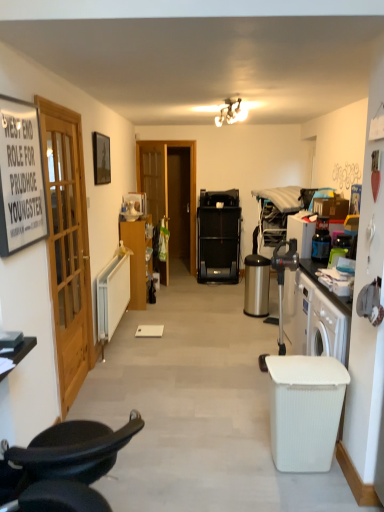
Question: Would you say black paper sign at left, arranged as the 1th picture frame when viewed from the front, is to the left or to the right of matte wood cabinet at left in the picture?

Choices:
 (A) left
 (B) right

Answer: (A)

Question: Relative to matte wood cabinet at left, is black paper sign at left, the second picture frame in the back-to-front sequence, in front or behind?

Choices:
 (A) front
 (B) behind

Answer: (A)

Question: Based on their relative distances, which object is farther from the matte white light fixture at upper center?

Choices:
 (A) black leather chair at lower left
 (B) satin silver trash can at lower right, marked as the first trash bin/can in a back-to-front arrangement
 (C) matte black picture frame at upper left, acting as the 2th picture frame starting from the front
 (D) wooden door at left
 (E) matte wood cabinet at left

Answer: (A)

Question: Which of these objects is positioned closest to the satin silver trash can at lower right, marked as the first trash bin/can in a back-to-front arrangement?

Choices:
 (A) matte white light fixture at upper center
 (B) black paper sign at left, arranged as the 1th picture frame when viewed from the front
 (C) black leather chair at lower left
 (D) wooden door at left
 (E) matte black picture frame at upper left, acting as the 2th picture frame starting from the front

Answer: (A)